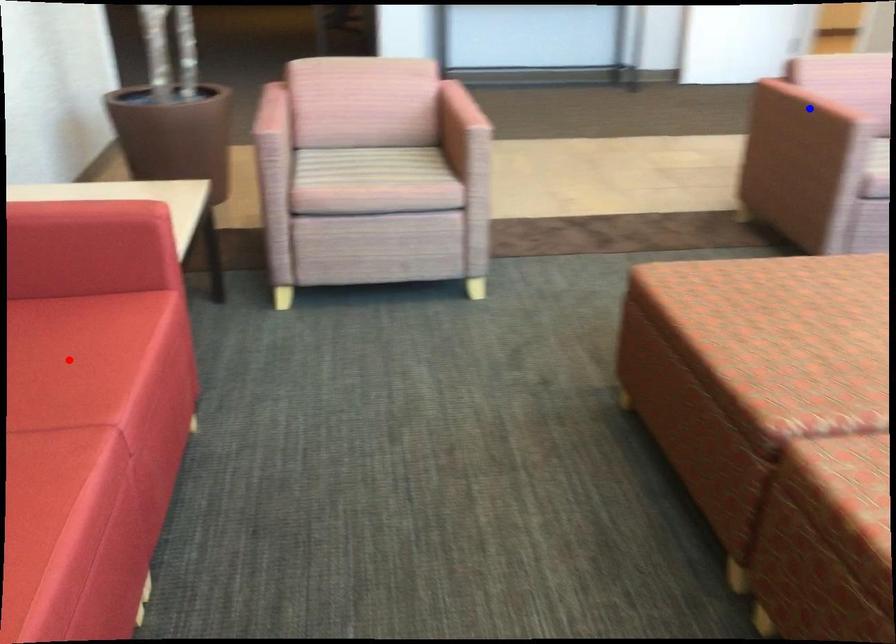
Question: In the image, two points are highlighted. Which point is nearer to the camera? Reply with the corresponding letter.

Choices:
 (A) blue point
 (B) red point

Answer: (B)